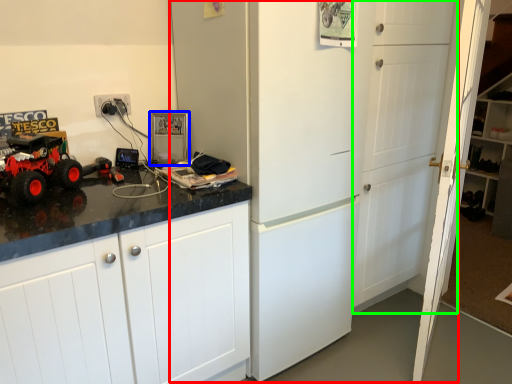
Question: Which object is the closest to the refrigerator (highlighted by a red box)? Choose among these: appliance (highlighted by a blue box) or door (highlighted by a green box).

Choices:
 (A) appliance
 (B) door

Answer: (B)